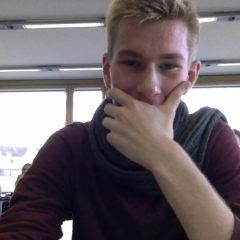
This screenshot has height=240, width=240. In order to click on ceiling lights in this screenshot , I will do `click(61, 25)`, `click(225, 63)`, `click(68, 69)`.